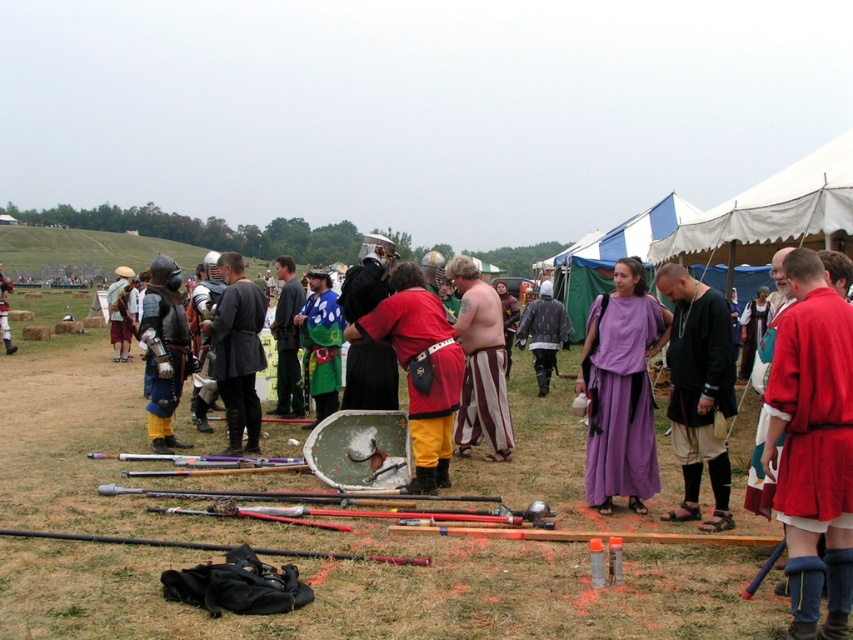
Who is shorter, striped cotton pants at center or shiny metallic armor at left?

shiny metallic armor at left is shorter.

Describe the element at coordinates (480, 364) in the screenshot. Image resolution: width=853 pixels, height=640 pixels. I see `striped cotton pants at center` at that location.

Is point (485, 417) closer to viewer compared to point (183, 362)?

That is True.

Locate an element on the screen. The image size is (853, 640). striped cotton pants at center is located at coordinates (480, 364).

Does shiny metallic armor at left appear on the right side of green fabric cape at center?

Incorrect, shiny metallic armor at left is not on the right side of green fabric cape at center.

Does point (160, 292) come behind point (286, 362)?

No, it is in front of (286, 362).

Who is more distant from viewer, (155, 308) or (277, 268)?

Point (277, 268)

Find the location of `shiny metallic armor at left`. shiny metallic armor at left is located at coordinates (163, 358).

Between dark gray leather armor at center and rubberized red pants at center, which one is positioned lower?

rubberized red pants at center

From the picture: Measure the distance from dark gray leather armor at center to rubberized red pants at center.

dark gray leather armor at center is 6.93 feet from rubberized red pants at center.

Image resolution: width=853 pixels, height=640 pixels. I want to click on dark gray leather armor at center, so click(236, 353).

You are a GUI agent. You are given a task and a screenshot of the screen. Output one action in this format:
    pyautogui.click(x=<x>, y=<y>)
    Task: Click on the dark gray leather armor at center
    Image resolution: width=853 pixels, height=640 pixels.
    Given the screenshot: What is the action you would take?
    pyautogui.click(x=236, y=353)